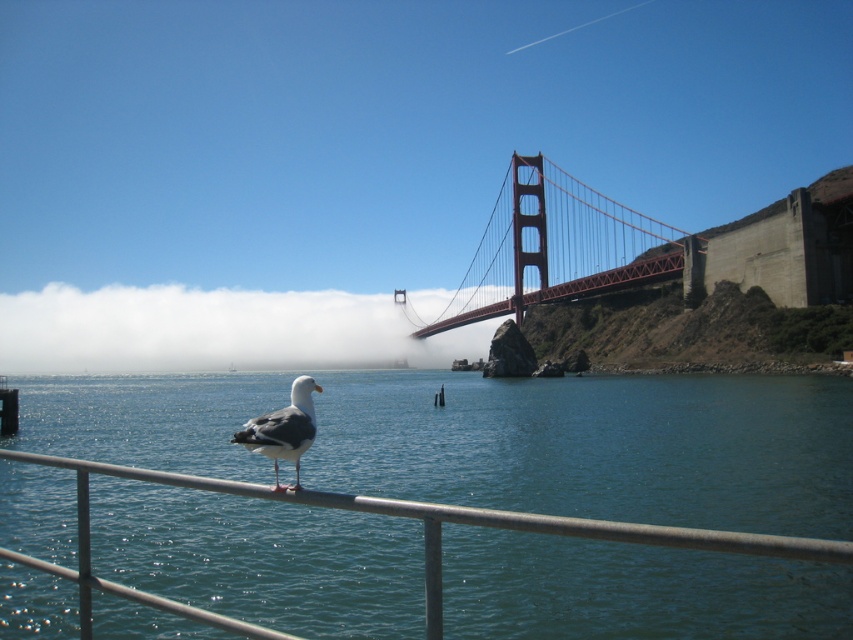
Looking at the Golden Gate Bridge scene, which object takes up more space in the image between the white misty fog at center and the red painted steel golden gate bridge at center?

The white misty fog at center takes up more space in the image than the red painted steel golden gate bridge at center according to the description.

You are a photographer planning to capture the Golden Gate Bridge at its most iconic. Given the scene, which object in the image has a greater width when comparing the white misty fog at center and the red painted steel golden gate bridge at center?

The white misty fog at center has a greater width than the red painted steel golden gate bridge at center.

You are a photographer standing on the Golden Gate Bridge and see the blue water at center and the white misty fog at center. Which object is closer to you, the photographer?

The blue water at center is closer to you because it is in front of the white misty fog at center.